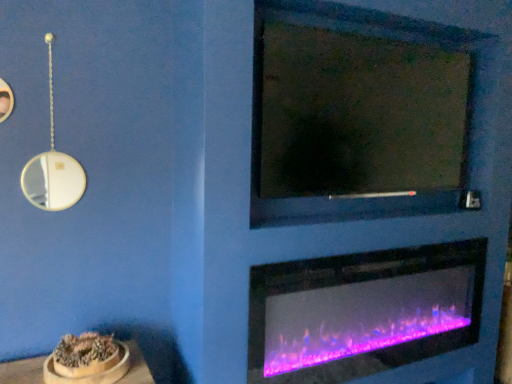
Question: Is purple glass fireplace at lower center to the left or to the right of matte glass mirror at upper center in the image?

Choices:
 (A) left
 (B) right

Answer: (B)

Question: Considering the positions of purple glass fireplace at lower center and matte glass mirror at upper center in the image, is purple glass fireplace at lower center taller or shorter than matte glass mirror at upper center?

Choices:
 (A) tall
 (B) short

Answer: (B)

Question: Looking at the image, does purple glass fireplace at lower center seem bigger or smaller compared to matte glass mirror at upper center?

Choices:
 (A) big
 (B) small

Answer: (B)

Question: Is point (300, 21) positioned closer to the camera than point (249, 377)?

Choices:
 (A) farther
 (B) closer

Answer: (A)

Question: From a real-world perspective, is matte glass mirror at upper center positioned above or below purple glass fireplace at lower center?

Choices:
 (A) below
 (B) above

Answer: (B)

Question: From the image's perspective, is matte glass mirror at upper center located above or below purple glass fireplace at lower center?

Choices:
 (A) above
 (B) below

Answer: (A)

Question: Looking at the image, does matte glass mirror at upper center seem bigger or smaller compared to purple glass fireplace at lower center?

Choices:
 (A) big
 (B) small

Answer: (A)